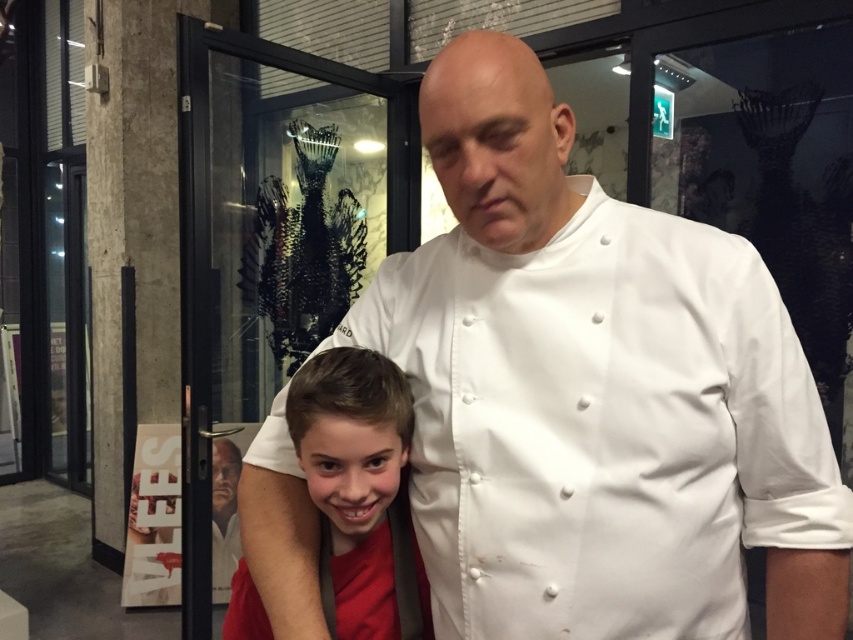
You are a customer entering the restaurant and need to find the chef. Based on the scene description, which object is closer to you between the white matte chef coat at center and the red matte shirt at lower left?

The white matte chef coat at center is closer to you because it is in front of the red matte shirt at lower left.

You are a customer entering the restaurant and see the white matte chef coat at center and the red matte shirt at lower left. Which clothing item appears taller in the image?

The white matte chef coat at center appears taller than the red matte shirt at lower left.

You are a customer entering the restaurant and want to identify the staff member. Which person is wearing the larger clothing item between the white matte chef coat at center and the red matte shirt at lower left?

The white matte chef coat at center has a larger size compared to the red matte shirt at lower left, so the staff member wearing the white matte chef coat at center is the one with the larger clothing item.